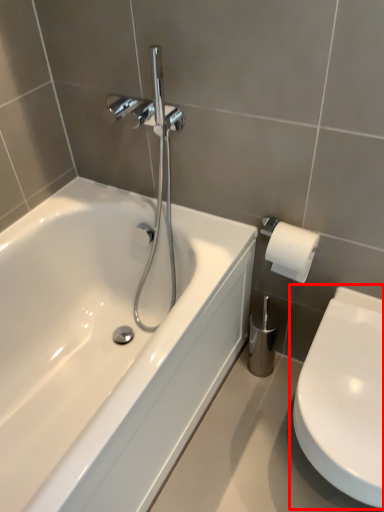
Question: In this image, where is toilet (annotated by the red box) located relative to bathtub?

Choices:
 (A) right
 (B) left

Answer: (A)